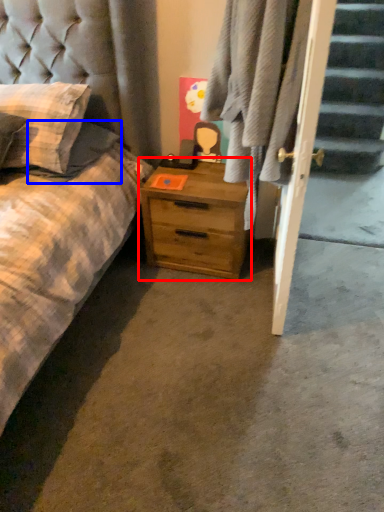
Question: Which point is closer to the camera, nightstand (highlighted by a red box) or pillow (highlighted by a blue box)?

Choices:
 (A) nightstand
 (B) pillow

Answer: (B)